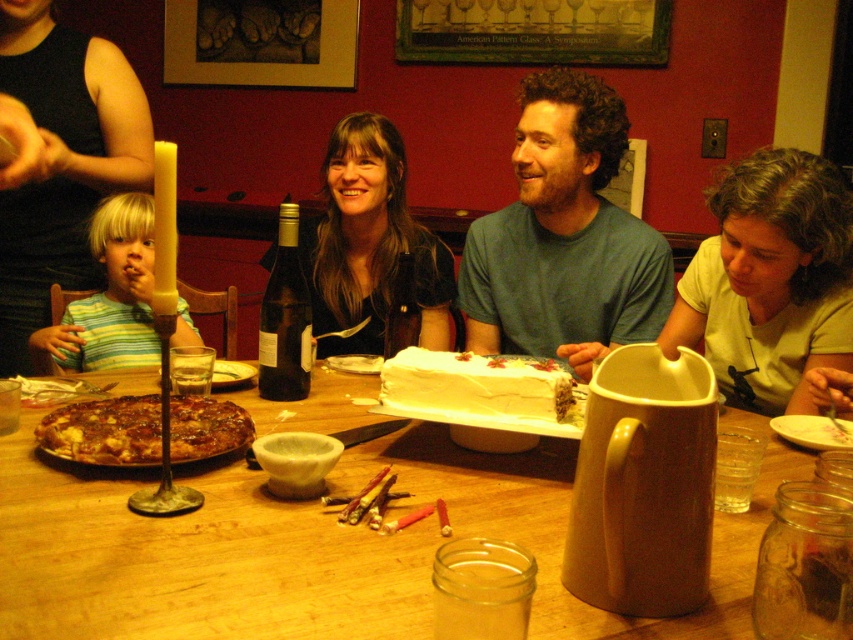
You are a guest at this gathering and need to place your striped cotton shirt at left on the wooden table at center. Can you tell me if the shirt will fit on the table?

The wooden table at center is larger in size than striped cotton shirt at left, so the shirt will fit on the table.

Consider the image. You are a guest at this dinner party and want to place a rectangular gift box on the table without overlapping any existing items. The gift box is as wide as the white frosting cake at center. Where on the wooden table at center could you place the gift box?

The wooden table at center is wider than the white frosting cake at center, so you can place the gift box on the wooden table at center in an area where there are no existing items, ensuring it doesn not overlap since the table has enough width to accommodate the gift box of the cake s width.